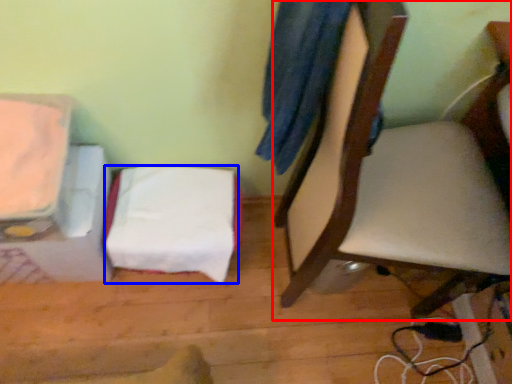
Question: Which object is further to the camera taking this photo, chair (highlighted by a red box) or sheet (highlighted by a blue box)?

Choices:
 (A) chair
 (B) sheet

Answer: (B)